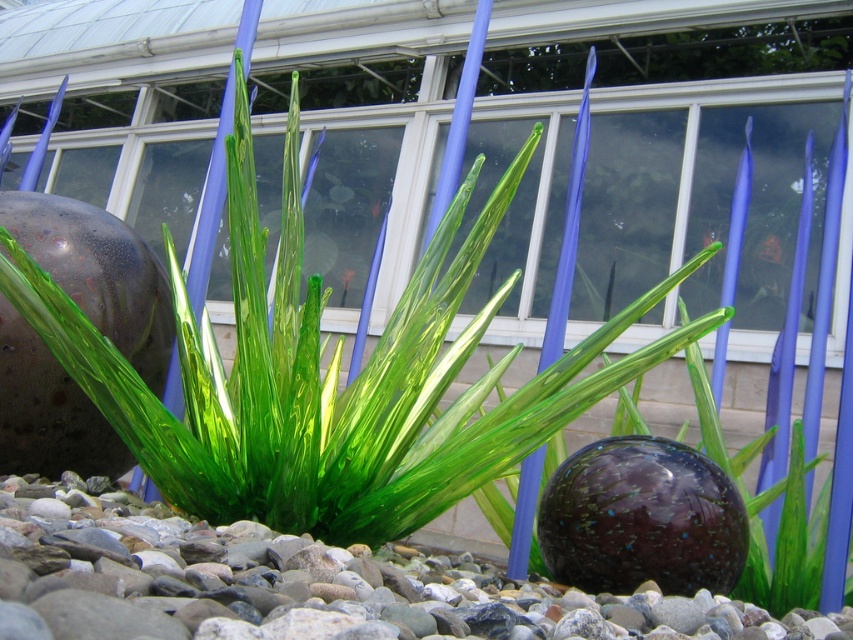
Question: Does green glass plant at center have a lesser width compared to smooth pebbles at center?

Choices:
 (A) no
 (B) yes

Answer: (B)

Question: Is green glass plant at center thinner than smooth pebbles at center?

Choices:
 (A) no
 (B) yes

Answer: (B)

Question: Which point is closer to the camera?

Choices:
 (A) (761, 625)
 (B) (85, 330)

Answer: (A)

Question: Which of the following is the farthest from the observer?

Choices:
 (A) smooth pebbles at center
 (B) green glass plant at center

Answer: (B)

Question: Considering the relative positions of green glass plant at center and smooth pebbles at center in the image provided, where is green glass plant at center located with respect to smooth pebbles at center?

Choices:
 (A) right
 (B) left

Answer: (B)

Question: Which point is farther from the camera taking this photo?

Choices:
 (A) (368, 627)
 (B) (288, 225)

Answer: (B)